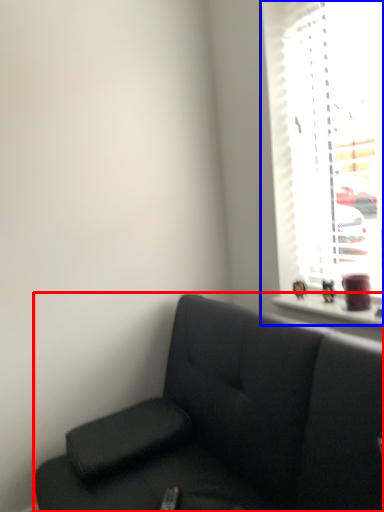
Question: Which of the following is the closest to the observer, studio couch (highlighted by a red box) or window (highlighted by a blue box)?

Choices:
 (A) studio couch
 (B) window

Answer: (A)